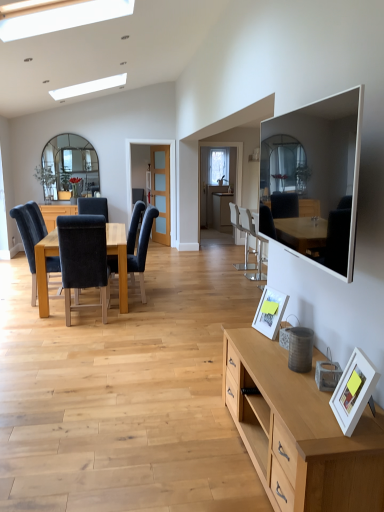
Question: Considering the relative positions of velvet dark blue chair at center left, arranged as the 5th chair when viewed from the right, and white plastic chair at center, acting as the second chair starting from the right, in the image provided, is velvet dark blue chair at center left, arranged as the 5th chair when viewed from the right, behind white plastic chair at center, acting as the second chair starting from the right,?

Choices:
 (A) yes
 (B) no

Answer: (B)

Question: From a real-world perspective, is velvet dark blue chair at center left, the 1th chair positioned from the left, located higher than white plastic chair at center, the fourth chair from the left?

Choices:
 (A) no
 (B) yes

Answer: (B)

Question: Can you confirm if velvet dark blue chair at center left, arranged as the fourth chair when viewed from the front, is positioned to the right of white plastic chair at center, which is the 1th chair from back to front?

Choices:
 (A) yes
 (B) no

Answer: (B)

Question: Can you confirm if velvet dark blue chair at center left, arranged as the fourth chair when viewed from the front, is bigger than white plastic chair at center, the fourth chair from the left?

Choices:
 (A) yes
 (B) no

Answer: (B)

Question: Is there a large distance between velvet dark blue chair at center left, arranged as the 5th chair when viewed from the right, and white plastic chair at center, the fourth chair from the left?

Choices:
 (A) yes
 (B) no

Answer: (A)

Question: Considering the relative sizes of velvet dark blue chair at center left, the 1th chair positioned from the left, and white plastic chair at center, which appears as the 5th chair when viewed from the front, in the image provided, is velvet dark blue chair at center left, the 1th chair positioned from the left, smaller than white plastic chair at center, which appears as the 5th chair when viewed from the front,?

Choices:
 (A) yes
 (B) no

Answer: (A)

Question: Does velvet black chair at left, which is the second chair in left-to-right order, have a greater width compared to white matte picture frame at lower right, which is the first picture frame in left-to-right order?

Choices:
 (A) no
 (B) yes

Answer: (B)

Question: Considering the relative sizes of velvet black chair at left, which is counted as the 5th chair, starting from the back, and white matte picture frame at lower right, the first picture frame positioned from the back, in the image provided, is velvet black chair at left, which is counted as the 5th chair, starting from the back, thinner than white matte picture frame at lower right, the first picture frame positioned from the back,?

Choices:
 (A) no
 (B) yes

Answer: (A)

Question: Considering the relative positions of velvet black chair at left, acting as the 1th chair starting from the front, and white matte picture frame at lower right, the first picture frame positioned from the back, in the image provided, is velvet black chair at left, acting as the 1th chair starting from the front, behind white matte picture frame at lower right, the first picture frame positioned from the back,?

Choices:
 (A) no
 (B) yes

Answer: (B)

Question: Is there a large distance between velvet black chair at left, which is the second chair in left-to-right order, and white matte picture frame at lower right, the 2th picture frame positioned from the right?

Choices:
 (A) yes
 (B) no

Answer: (A)

Question: Would you say velvet black chair at left, which is counted as the 5th chair, starting from the back, contains white matte picture frame at lower right, the first picture frame positioned from the back?

Choices:
 (A) yes
 (B) no

Answer: (B)

Question: From the image's perspective, is velvet black chair at left, marked as the 4th chair in a right-to-left arrangement, below white matte picture frame at lower right, the first picture frame positioned from the back?

Choices:
 (A) yes
 (B) no

Answer: (B)

Question: Does velvet black chair at left, acting as the 1th chair starting from the front, have a smaller size compared to metallic silver bar stool at center, the third chair when ordered from back to front?

Choices:
 (A) no
 (B) yes

Answer: (A)